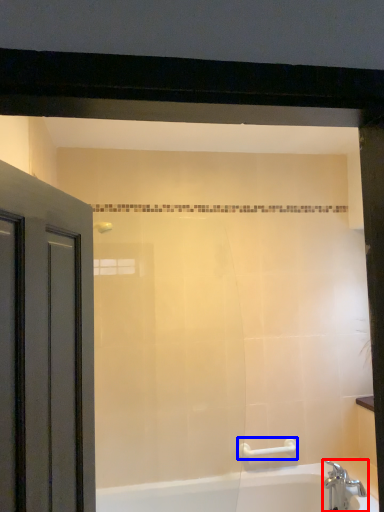
Question: Which object is closer to the camera taking this photo, tap (highlighted by a red box) or towel bar (highlighted by a blue box)?

Choices:
 (A) tap
 (B) towel bar

Answer: (A)